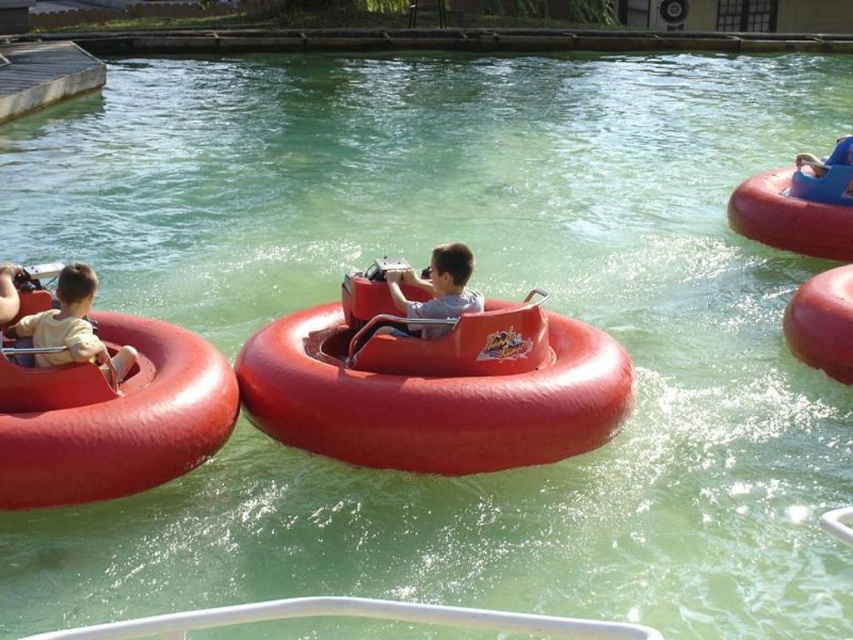
You are a lifeguard at the water park and need to determine if a child can move from the rubber boat at center to the matte red bumper boat at left without getting out of the water. The water depth here is 1.2 meters. Can they do it?

The rubber boat at center might be wider than matte red bumper boat at left, but the water depth is 1.2 meters, so the child can swim between them without needing to stand. Yes, they can move between the boats without leaving the water.

You are standing at the edge of the water park pool and see the matte red bumper boat at upper right and the matte orange life ring at left. If you want to swim from the boat to the life ring, will you have to swim more than 40 feet?

The matte red bumper boat at upper right is 41.78 feet away from the matte orange life ring at left. Therefore, swimming from the boat to the life ring would require swimming more than 40 feet.

You are a visitor at the water park and want to take a photo of both the matte red bumper boat at left and the matte red bumper boat at upper right. Which boat should you focus on first to ensure both are in the frame?

You should focus on the matte red bumper boat at left first since it is closer to the viewer than the matte red bumper boat at upper right, allowing both to be captured in the frame.